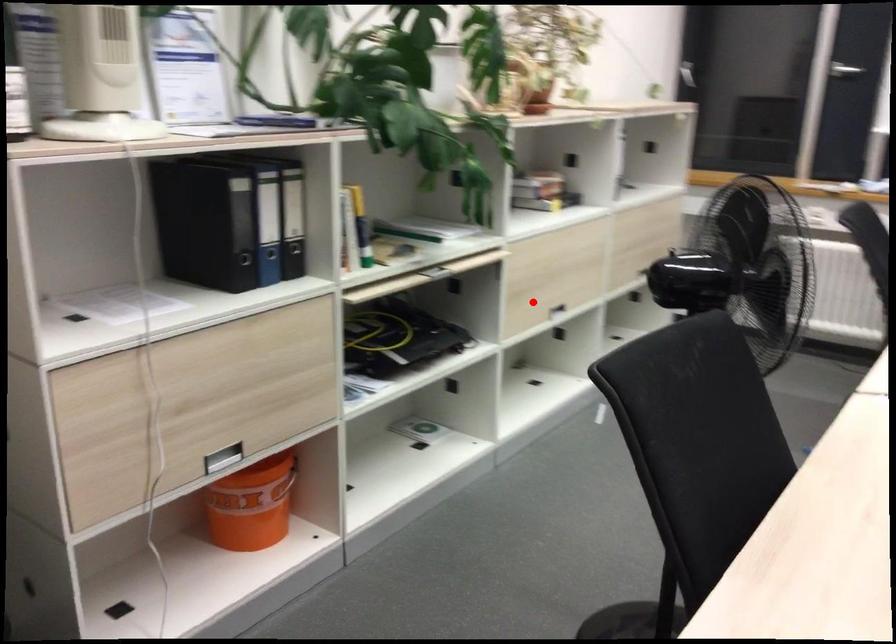
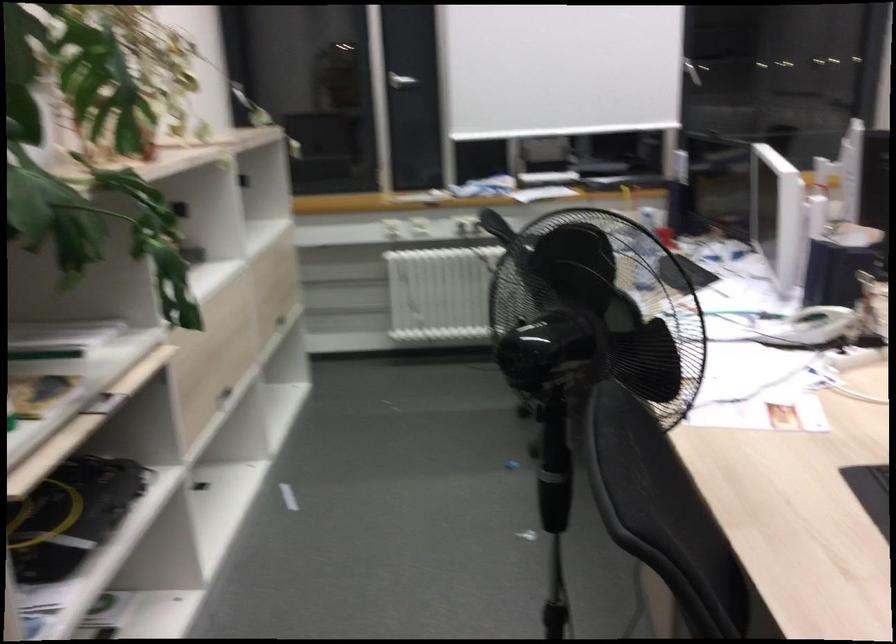
Question: I am providing you with two images of the same scene from different viewpoints. In image1, a red point is highlighted. Considering the same 3D point in image2, which of the following is correct?

Choices:
 (A) It is closer
 (B) It is farther

Answer: (A)